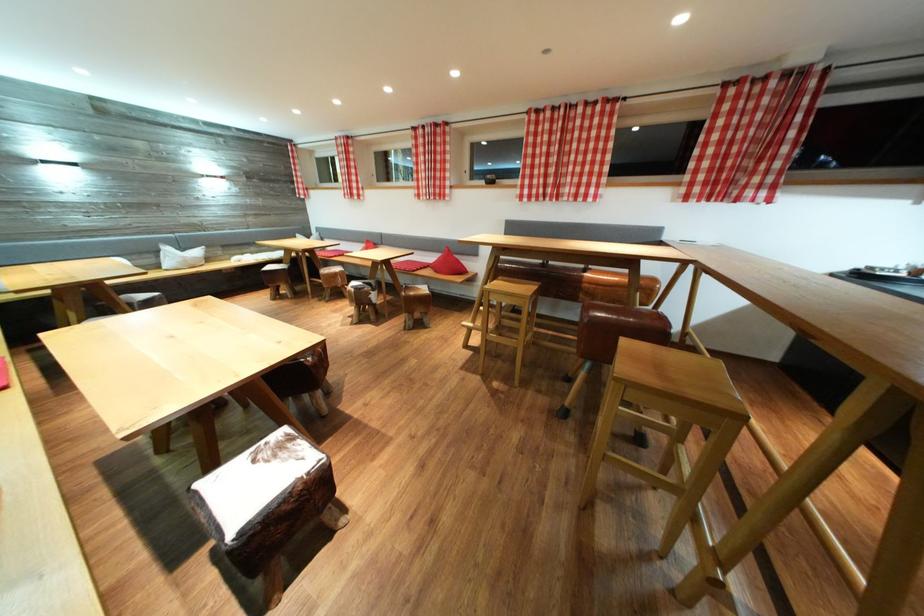
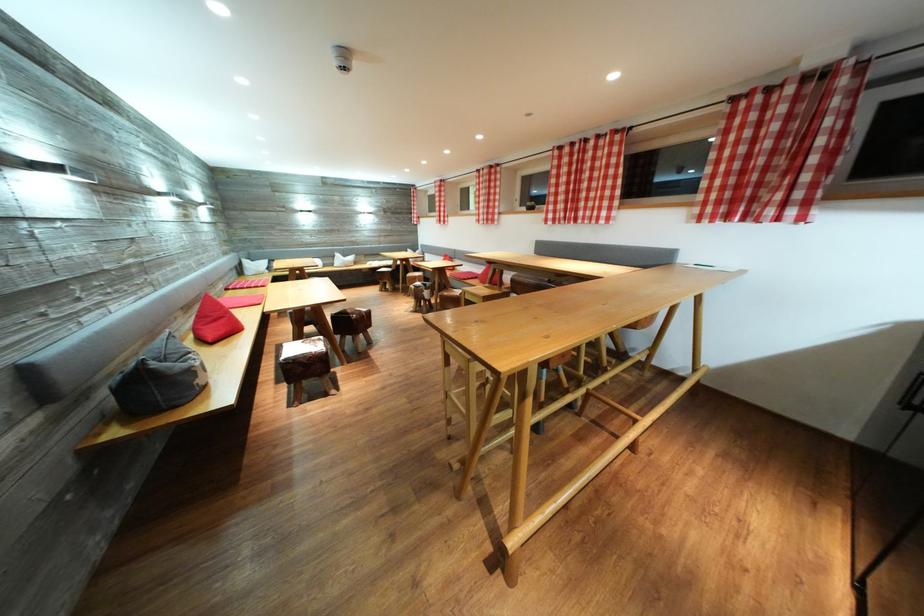
Find the pixel in the second image that matches point 332,277 in the first image.

(417, 280)